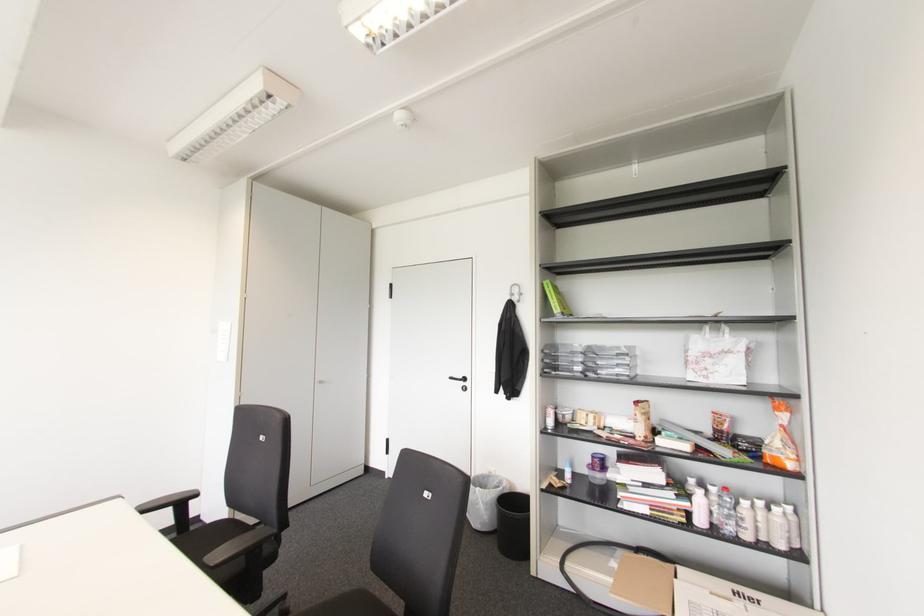
Find the location of a particular element. silver cabinet handle is located at coordinates (459, 381).